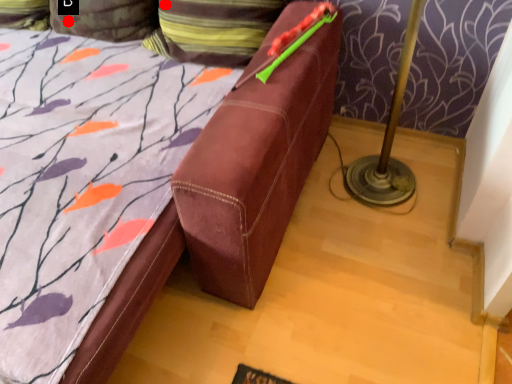
Question: Two points are circled on the image, labeled by A and B beside each circle. Which point is farther to the camera?

Choices:
 (A) A is further
 (B) B is further

Answer: (B)